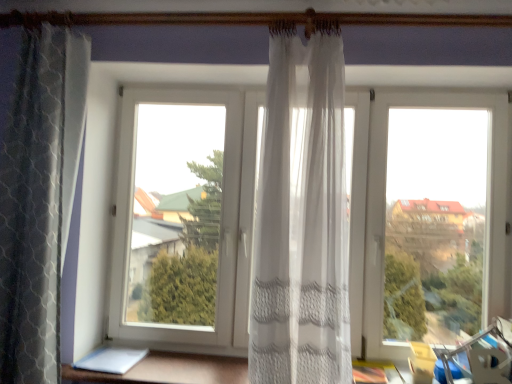
This screenshot has height=384, width=512. Describe the element at coordinates (384, 207) in the screenshot. I see `transparent plastic window at center` at that location.

Locate an element on the screen. textured gray curtain at left, arranged as the 1th curtain when viewed from the left is located at coordinates (39, 199).

The width and height of the screenshot is (512, 384). In order to click on transparent plastic window at center in this screenshot , I will do `click(384, 207)`.

From a real-world perspective, is transparent plastic window at center under white sheer curtain at lower center?

No.

Would you say transparent plastic window at center is a long distance from white sheer curtain at lower center?

Yes.

In the scene shown: Which object is thinner, transparent plastic window at center or white sheer curtain at lower center?

With smaller width is transparent plastic window at center.

Is transparent plastic window at center looking in the opposite direction of white sheer curtain at lower center?

transparent plastic window at center does not have its back to white sheer curtain at lower center.

From a real-world perspective, between transparent plastic window at center and sheer white curtain at center, marked as the first curtain in a right-to-left arrangement, who is vertically higher?

sheer white curtain at center, marked as the first curtain in a right-to-left arrangement, from a real-world perspective.

How different are the orientations of transparent plastic window at center and sheer white curtain at center, marked as the first curtain in a right-to-left arrangement, in degrees?

The angle between the facing direction of transparent plastic window at center and the facing direction of sheer white curtain at center, marked as the first curtain in a right-to-left arrangement, is 4.37 degrees.

Is transparent plastic window at center at the left side of sheer white curtain at center, which ranks as the 2th curtain in left-to-right order?

No, transparent plastic window at center is not to the left of sheer white curtain at center, which ranks as the 2th curtain in left-to-right order.

Does transparent plastic window at center have a greater height compared to sheer white curtain at center, marked as the first curtain in a right-to-left arrangement?

No.

In terms of size, does white sheer curtain at lower center appear bigger or smaller than textured gray curtain at left, arranged as the 1th curtain when viewed from the left?

Considering their sizes, white sheer curtain at lower center takes up less space than textured gray curtain at left, arranged as the 1th curtain when viewed from the left.

Is white sheer curtain at lower center taller than textured gray curtain at left, arranged as the second curtain when viewed from the right?

No, white sheer curtain at lower center is not taller than textured gray curtain at left, arranged as the second curtain when viewed from the right.

Considering the positions of objects white sheer curtain at lower center and textured gray curtain at left, arranged as the second curtain when viewed from the right, in the image provided, who is in front, white sheer curtain at lower center or textured gray curtain at left, arranged as the second curtain when viewed from the right,?

textured gray curtain at left, arranged as the second curtain when viewed from the right, is in front.

Can you confirm if white sheer curtain at lower center is shorter than transparent plastic window at center?

Yes, white sheer curtain at lower center is shorter than transparent plastic window at center.

Is white sheer curtain at lower center turned away from transparent plastic window at center?

white sheer curtain at lower center is not turned away from transparent plastic window at center.

Does white sheer curtain at lower center have a smaller size compared to transparent plastic window at center?

Yes, white sheer curtain at lower center is smaller than transparent plastic window at center.

Is sheer white curtain at center, which ranks as the 2th curtain in left-to-right order, with transparent plastic window at center?

There is a gap between sheer white curtain at center, which ranks as the 2th curtain in left-to-right order, and transparent plastic window at center.

Which of these two, sheer white curtain at center, which ranks as the 2th curtain in left-to-right order, or transparent plastic window at center, is thinner?

Thinner between the two is transparent plastic window at center.

From the picture: Is sheer white curtain at center, marked as the first curtain in a right-to-left arrangement, positioned with its back to transparent plastic window at center?

Yes, sheer white curtain at center, marked as the first curtain in a right-to-left arrangement, is positioned with its back facing transparent plastic window at center.

Considering the sizes of objects textured gray curtain at left, arranged as the 1th curtain when viewed from the left, and white sheer curtain at lower center in the image provided, who is wider, textured gray curtain at left, arranged as the 1th curtain when viewed from the left, or white sheer curtain at lower center?

With larger width is white sheer curtain at lower center.

From the image's perspective, between textured gray curtain at left, arranged as the second curtain when viewed from the right, and white sheer curtain at lower center, who is located below?

white sheer curtain at lower center, from the image's perspective.

From a real-world perspective, which is physically below, textured gray curtain at left, arranged as the second curtain when viewed from the right, or white sheer curtain at lower center?

white sheer curtain at lower center, from a real-world perspective.

Who is bigger, textured gray curtain at left, arranged as the 1th curtain when viewed from the left, or white sheer curtain at lower center?

With larger size is textured gray curtain at left, arranged as the 1th curtain when viewed from the left.

Which of these two, textured gray curtain at left, arranged as the 1th curtain when viewed from the left, or transparent plastic window at center, stands shorter?

transparent plastic window at center.

Is textured gray curtain at left, arranged as the 1th curtain when viewed from the left, with transparent plastic window at center?

textured gray curtain at left, arranged as the 1th curtain when viewed from the left, and transparent plastic window at center are not in contact.

From the image's perspective, is textured gray curtain at left, arranged as the second curtain when viewed from the right, located above or below transparent plastic window at center?

Based on their image positions, textured gray curtain at left, arranged as the second curtain when viewed from the right, is located above transparent plastic window at center.

I want to click on furniture in front of the transparent plastic window at center, so click(x=169, y=370).

In order to click on window behind the sheer white curtain at center, marked as the first curtain in a right-to-left arrangement in this screenshot , I will do `click(384, 207)`.

Based on their spatial positions, is transparent plastic window at center or white sheer curtain at lower center further from sheer white curtain at center, which ranks as the 2th curtain in left-to-right order?

white sheer curtain at lower center is further to sheer white curtain at center, which ranks as the 2th curtain in left-to-right order.

From the image, which object appears to be nearer to transparent plastic window at center, sheer white curtain at center, which ranks as the 2th curtain in left-to-right order, or white sheer curtain at lower center?

sheer white curtain at center, which ranks as the 2th curtain in left-to-right order, lies closer to transparent plastic window at center than the other object.

When comparing their distances from sheer white curtain at center, which ranks as the 2th curtain in left-to-right order, does textured gray curtain at left, arranged as the second curtain when viewed from the right, or transparent plastic window at center seem closer?

Among the two, transparent plastic window at center is located nearer to sheer white curtain at center, which ranks as the 2th curtain in left-to-right order.

Considering their positions, is textured gray curtain at left, arranged as the 1th curtain when viewed from the left, positioned further to white sheer curtain at lower center than transparent plastic window at center?

The object further to white sheer curtain at lower center is transparent plastic window at center.

Considering their positions, is white sheer curtain at lower center positioned further to textured gray curtain at left, arranged as the second curtain when viewed from the right, than transparent plastic window at center?

Based on the image, transparent plastic window at center appears to be further to textured gray curtain at left, arranged as the second curtain when viewed from the right.

From the image, which object appears to be farther from textured gray curtain at left, arranged as the 1th curtain when viewed from the left, transparent plastic window at center or sheer white curtain at center, which ranks as the 2th curtain in left-to-right order?

The object further to textured gray curtain at left, arranged as the 1th curtain when viewed from the left, is transparent plastic window at center.

When comparing their distances from transparent plastic window at center, does white sheer curtain at lower center or textured gray curtain at left, arranged as the second curtain when viewed from the right, seem further?

The object further to transparent plastic window at center is textured gray curtain at left, arranged as the second curtain when viewed from the right.

Considering their positions, is white sheer curtain at lower center positioned further to sheer white curtain at center, marked as the first curtain in a right-to-left arrangement, than transparent plastic window at center?

The object further to sheer white curtain at center, marked as the first curtain in a right-to-left arrangement, is white sheer curtain at lower center.

You are a GUI agent. You are given a task and a screenshot of the screen. Output one action in this format:
    pyautogui.click(x=<x>, y=<y>)
    Task: Click on the curtain between textured gray curtain at left, arranged as the 1th curtain when viewed from the left, and transparent plastic window at center, in the horizontal direction
    This screenshot has height=384, width=512.
    Given the screenshot: What is the action you would take?
    pyautogui.click(x=301, y=219)

This screenshot has width=512, height=384. I want to click on furniture situated between textured gray curtain at left, arranged as the 1th curtain when viewed from the left, and transparent plastic window at center from left to right, so (x=169, y=370).

At what (x,y) coordinates should I click in order to perform the action: click on window between sheer white curtain at center, which ranks as the 2th curtain in left-to-right order, and white sheer curtain at lower center from top to bottom. Please return your answer as a coordinate pair (x, y). Image resolution: width=512 pixels, height=384 pixels. Looking at the image, I should click on (384, 207).

You are a GUI agent. You are given a task and a screenshot of the screen. Output one action in this format:
    pyautogui.click(x=<x>, y=<y>)
    Task: Click on the furniture located between textured gray curtain at left, arranged as the 1th curtain when viewed from the left, and sheer white curtain at center, marked as the first curtain in a right-to-left arrangement, in the left-right direction
    
    Given the screenshot: What is the action you would take?
    pyautogui.click(x=169, y=370)